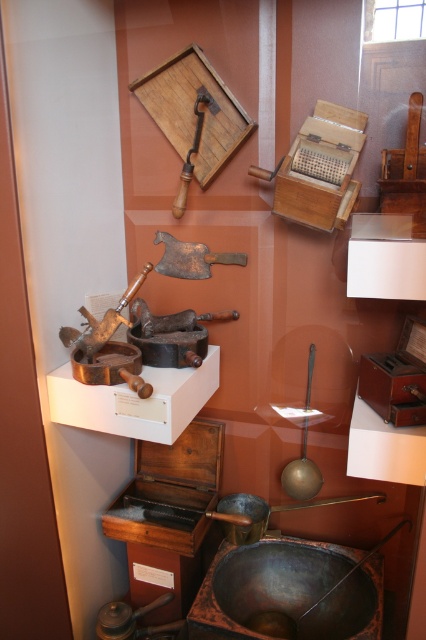
Between matte silver hammer at center-left and wooden handle at upper center, which one is positioned higher?

wooden handle at upper center

Between matte silver hammer at center-left and wooden handle at upper center, which one has more height?

Standing taller between the two is wooden handle at upper center.

Who is more forward, (85, 316) or (187, 172)?

Point (85, 316) is more forward.

This screenshot has width=426, height=640. In order to click on matte silver hammer at center-left in this screenshot , I will do `click(101, 321)`.

Between brass/bronze axe at center and matte silver hammer at center-left, which one appears on the right side from the viewer's perspective?

From the viewer's perspective, brass/bronze axe at center appears more on the right side.

At what (x,y) coordinates should I click in order to perform the action: click on brass/bronze axe at center. Please return your answer as a coordinate pair (x, y). The height and width of the screenshot is (640, 426). Looking at the image, I should click on (190, 257).

Measure the distance from brass/bronze axe at center to wooden handle at upper center.

brass/bronze axe at center is 8.84 inches away from wooden handle at upper center.

Is brass/bronze axe at center further to the viewer compared to wooden handle at upper center?

Yes, it is behind wooden handle at upper center.

Who is more forward, (245, 256) or (204, 97)?

Point (204, 97) is in front.

Where is `brass/bronze axe at center`? This screenshot has height=640, width=426. brass/bronze axe at center is located at coordinates (190, 257).